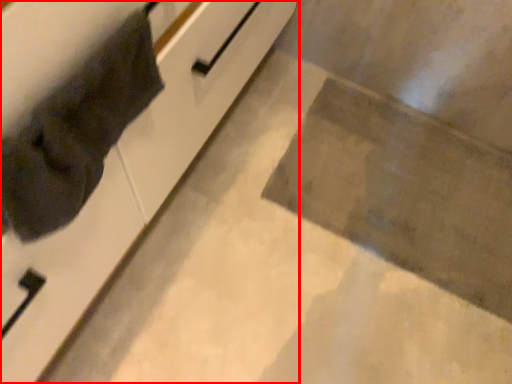
Question: From the image, what is the correct spatial relationship of cabinetry (annotated by the red box) in relation to cat?

Choices:
 (A) left
 (B) right

Answer: (A)